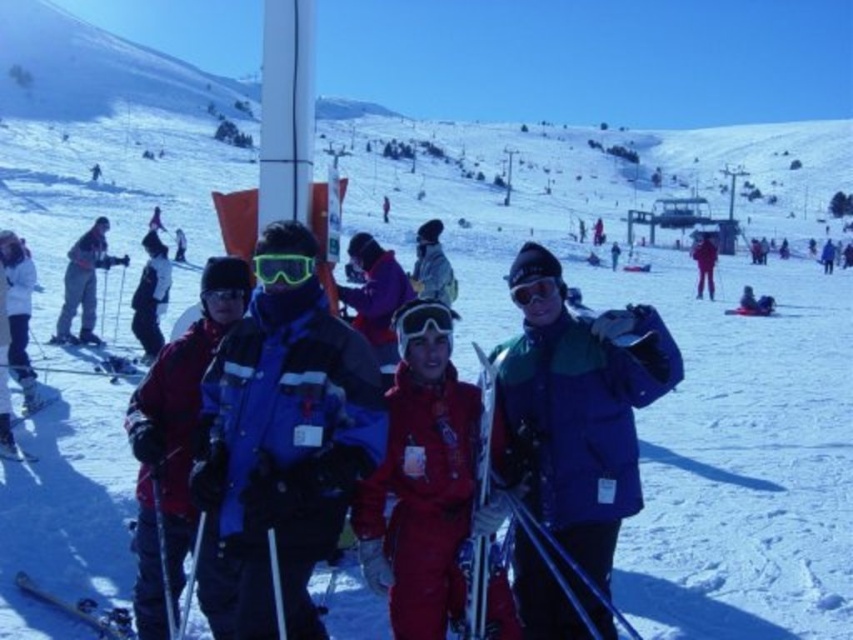
Image resolution: width=853 pixels, height=640 pixels. Describe the element at coordinates (476, 584) in the screenshot. I see `metallic ski at center` at that location.

Who is lower down, metallic ski at center or white matte jacket at left?

metallic ski at center

Find the location of a particular element. Image resolution: width=853 pixels, height=640 pixels. metallic ski at center is located at coordinates pos(476,584).

Who is more distant from viewer, (25, 404) or (1, 387)?

The point (25, 404) is behind.

Between point (24, 300) and point (3, 385), which one is positioned behind?

The point (24, 300) is behind.

You are a GUI agent. You are given a task and a screenshot of the screen. Output one action in this format:
    pyautogui.click(x=<x>, y=<y>)
    Task: Click on the white matte jacket at left
    
    Given the screenshot: What is the action you would take?
    pyautogui.click(x=19, y=312)

In the scene shown: Is transparent plastic goggles at center above neon green plastic goggles at center?

Incorrect, transparent plastic goggles at center is not positioned above neon green plastic goggles at center.

At what (x,y) coordinates should I click in order to perform the action: click on transparent plastic goggles at center. Please return your answer as a coordinate pair (x, y). Looking at the image, I should click on (422, 320).

You are a GUI agent. You are given a task and a screenshot of the screen. Output one action in this format:
    pyautogui.click(x=<x>, y=<y>)
    Task: Click on the transparent plastic goggles at center
    The width and height of the screenshot is (853, 640).
    Given the screenshot: What is the action you would take?
    pyautogui.click(x=422, y=320)